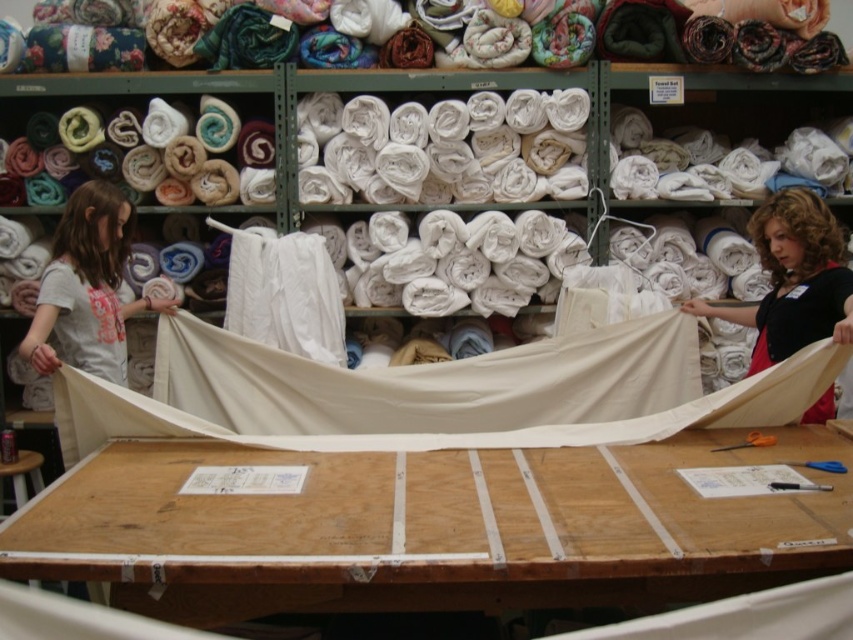
Question: Is wooden table at center bigger than matte black shirt at upper right?

Choices:
 (A) no
 (B) yes

Answer: (B)

Question: Which point is closer to the camera?

Choices:
 (A) (628, 544)
 (B) (753, 312)

Answer: (A)

Question: Can you confirm if wooden table at center is positioned below matte black shirt at upper right?

Choices:
 (A) no
 (B) yes

Answer: (B)

Question: Is wooden table at center further to camera compared to matte black shirt at upper right?

Choices:
 (A) no
 (B) yes

Answer: (A)